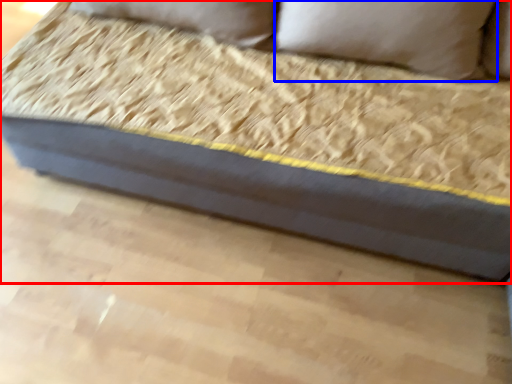
Question: Which point is closer to the camera, studio couch (highlighted by a red box) or pillow (highlighted by a blue box)?

Choices:
 (A) studio couch
 (B) pillow

Answer: (A)